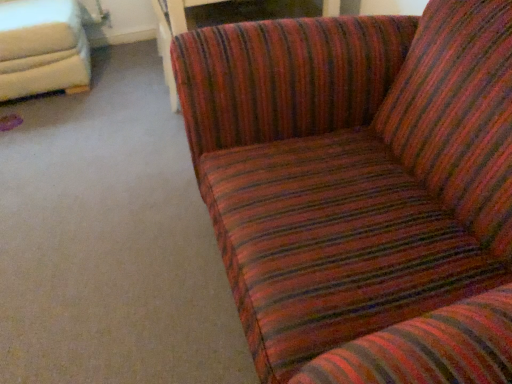
Question: Does wooden table at center have a lesser height compared to striped fabric couch at upper right, marked as the first studio couch in a right-to-left arrangement?

Choices:
 (A) yes
 (B) no

Answer: (B)

Question: Considering the relative positions of wooden table at center and striped fabric couch at upper right, the second studio couch positioned from the left, in the image provided, is wooden table at center behind striped fabric couch at upper right, the second studio couch positioned from the left,?

Choices:
 (A) yes
 (B) no

Answer: (A)

Question: Is wooden table at center closer to camera compared to striped fabric couch at upper right, the second studio couch positioned from the left?

Choices:
 (A) no
 (B) yes

Answer: (A)

Question: Are wooden table at center and striped fabric couch at upper right, marked as the first studio couch in a right-to-left arrangement, far apart?

Choices:
 (A) yes
 (B) no

Answer: (B)

Question: Can you confirm if wooden table at center is smaller than striped fabric couch at upper right, marked as the first studio couch in a right-to-left arrangement?

Choices:
 (A) yes
 (B) no

Answer: (A)

Question: Is point (297, 14) positioned closer to the camera than point (404, 273)?

Choices:
 (A) closer
 (B) farther

Answer: (B)

Question: Is wooden table at center inside or outside of striped fabric couch at upper right, marked as the first studio couch in a right-to-left arrangement?

Choices:
 (A) inside
 (B) outside

Answer: (B)

Question: Considering the positions of wooden table at center and striped fabric couch at upper right, the second studio couch positioned from the left, in the image, is wooden table at center wider or thinner than striped fabric couch at upper right, the second studio couch positioned from the left,?

Choices:
 (A) wide
 (B) thin

Answer: (B)

Question: From a real-world perspective, relative to striped fabric couch at upper right, marked as the first studio couch in a right-to-left arrangement, is wooden table at center vertically above or below?

Choices:
 (A) above
 (B) below

Answer: (A)

Question: Would you say white leather studio couch at upper left, the first studio couch viewed from the left, is inside or outside striped fabric couch at upper right, marked as the first studio couch in a right-to-left arrangement?

Choices:
 (A) outside
 (B) inside

Answer: (A)

Question: Is point (44, 72) closer or farther from the camera than point (387, 165)?

Choices:
 (A) farther
 (B) closer

Answer: (A)

Question: Looking at the image, does white leather studio couch at upper left, marked as the second studio couch in a right-to-left arrangement, seem bigger or smaller compared to striped fabric couch at upper right, the second studio couch positioned from the left?

Choices:
 (A) big
 (B) small

Answer: (B)

Question: From a real-world perspective, is white leather studio couch at upper left, the first studio couch viewed from the left, physically located above or below striped fabric couch at upper right, marked as the first studio couch in a right-to-left arrangement?

Choices:
 (A) above
 (B) below

Answer: (A)

Question: Is white leather studio couch at upper left, the first studio couch viewed from the left, situated inside wooden table at center or outside?

Choices:
 (A) inside
 (B) outside

Answer: (B)

Question: Is white leather studio couch at upper left, the first studio couch viewed from the left, wider or thinner than wooden table at center?

Choices:
 (A) wide
 (B) thin

Answer: (A)